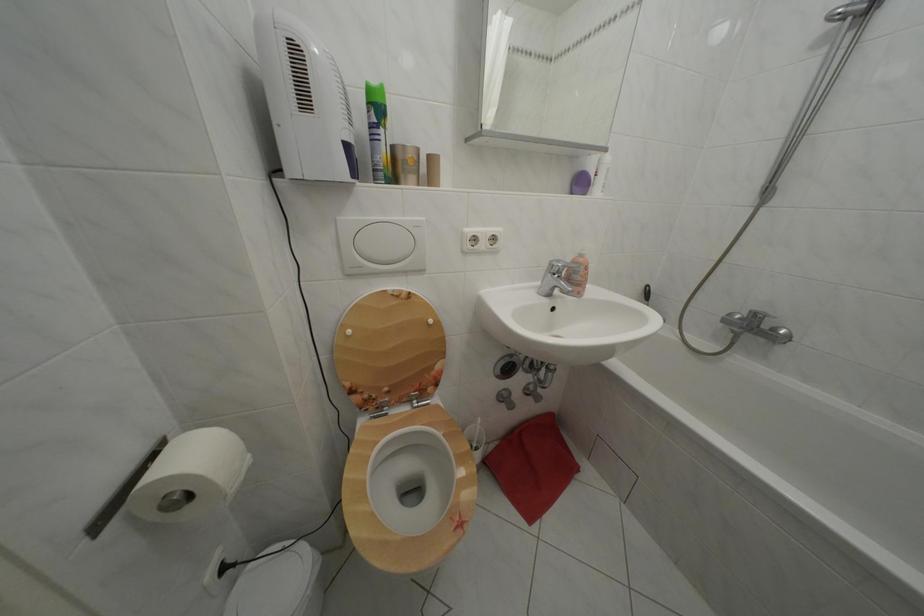
What do you see at coordinates (756, 326) in the screenshot?
I see `the bathtub faucet handle` at bounding box center [756, 326].